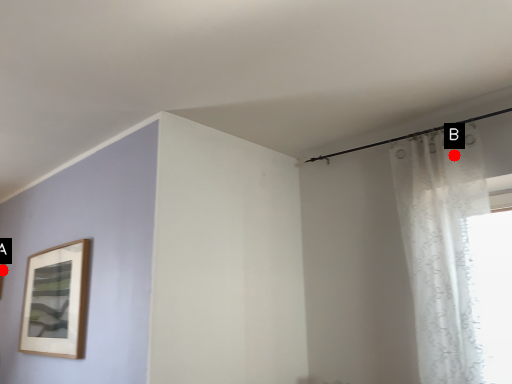
Question: Two points are circled on the image, labeled by A and B beside each circle. Which point is farther from the camera taking this photo?

Choices:
 (A) A is further
 (B) B is further

Answer: (A)